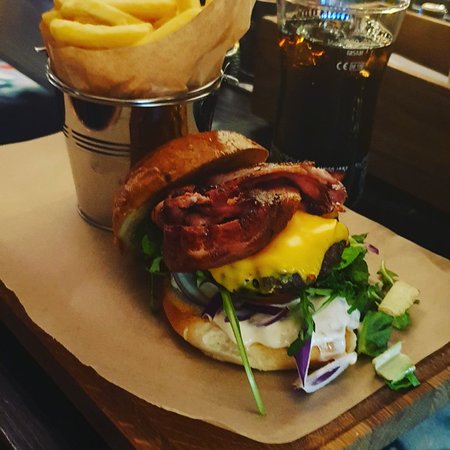
The width and height of the screenshot is (450, 450). I want to click on table, so click(421, 181).